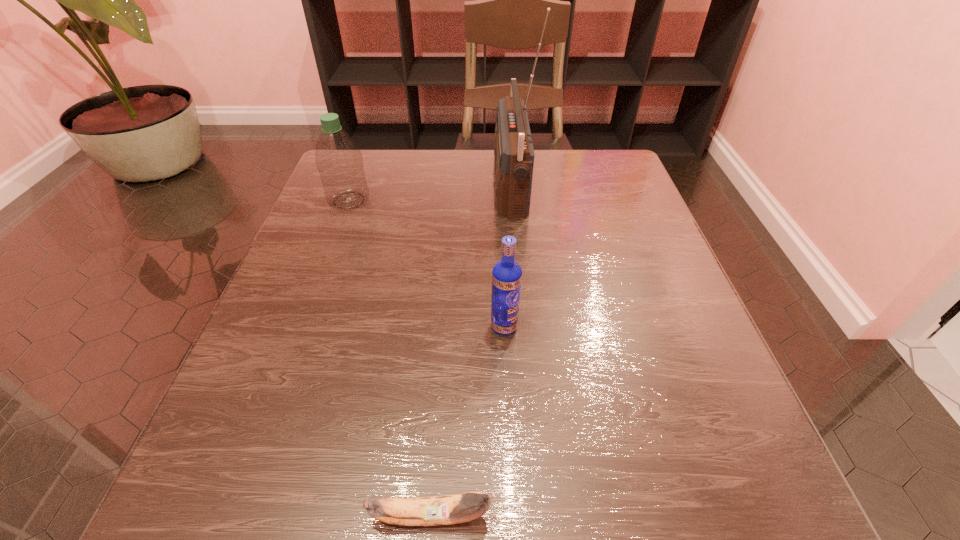
Find the location of a particular element. Image resolution: width=960 pixels, height=540 pixels. vacant space located 0.070m at the stem of the shortest object is located at coordinates (554, 516).

Image resolution: width=960 pixels, height=540 pixels. In order to click on radio receiver situated at the far edge in this screenshot , I will do `click(514, 154)`.

Where is `water bottle that is at the far edge`? The image size is (960, 540). water bottle that is at the far edge is located at coordinates [338, 158].

You are a GUI agent. You are given a task and a screenshot of the screen. Output one action in this format:
    pyautogui.click(x=<x>, y=<y>)
    Task: Click on the object positioned at the near edge
    
    Given the screenshot: What is the action you would take?
    tap(449, 509)

This screenshot has width=960, height=540. Identify the location of object present at the left edge. (338, 158).

Image resolution: width=960 pixels, height=540 pixels. What are the coordinates of `object that is at the far left corner` in the screenshot? It's located at (338, 158).

In the image, there is a desktop. Identify the location of free space at the far edge. pos(450,158).

The image size is (960, 540). Identify the location of free space at the near edge of the desktop. (558, 510).

Where is `vacant region at the left edge`? This screenshot has width=960, height=540. vacant region at the left edge is located at coordinates (261, 426).

The width and height of the screenshot is (960, 540). I want to click on vacant region at the right edge of the desktop, so click(754, 446).